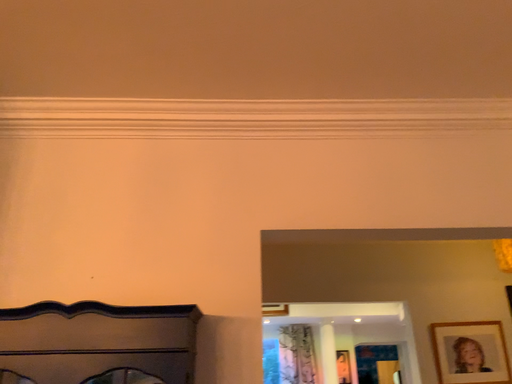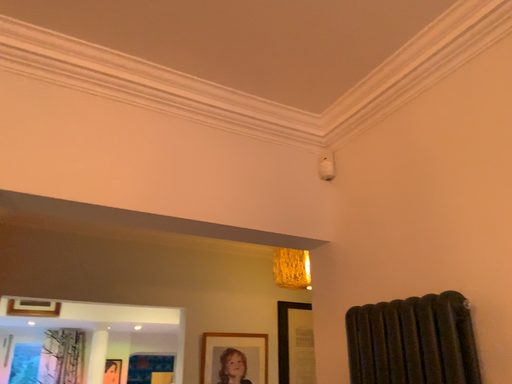
Question: How did the camera likely rotate when shooting the video?

Choices:
 (A) rotated left
 (B) rotated right

Answer: (B)